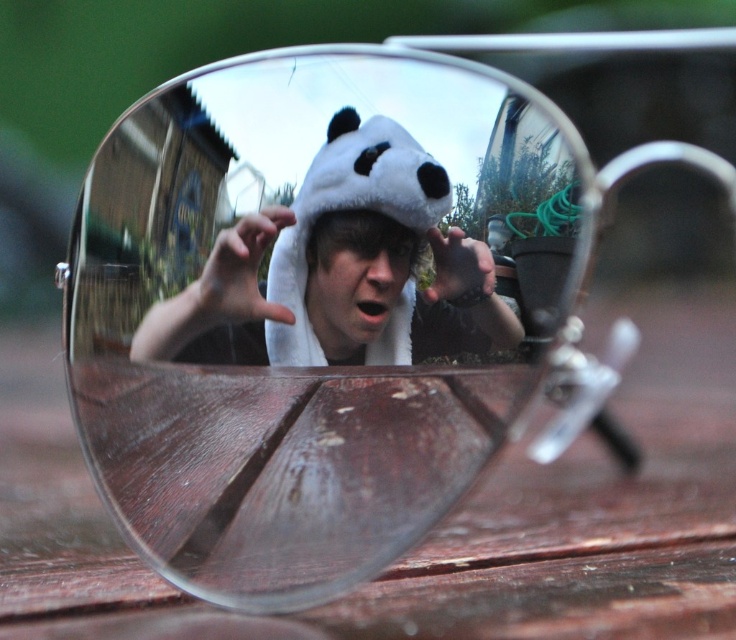
Between point (364, 188) and point (319, 333), which one is positioned in front?

Point (364, 188) is more forward.

I want to click on white plush panda hat at center, so click(339, 269).